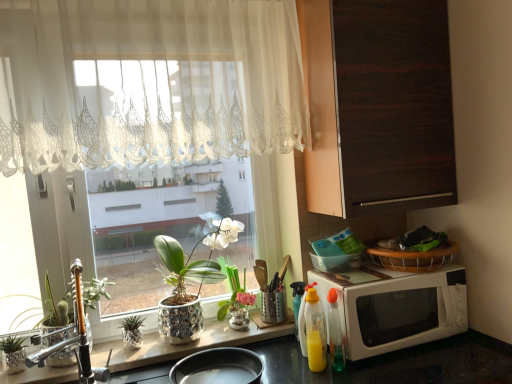
Question: Is green metallic plant at left, placed as the second houseplant when sorted from left to right, bigger or smaller than dark wood cabinet at upper right?

Choices:
 (A) big
 (B) small

Answer: (B)

Question: Looking at their shapes, would you say green metallic plant at left, placed as the second houseplant when sorted from left to right, is wider or thinner than dark wood cabinet at upper right?

Choices:
 (A) thin
 (B) wide

Answer: (A)

Question: Which object is the closest to the matte silver pot at center, the 1th houseplant when ordered from right to left?

Choices:
 (A) translucent glass pineapple at lower center, the 3th houseplant from the left
 (B) translucent plastic bottle at lower right, which is counted as the third bottle, starting from the back
 (C) silver metallic pot at left, which is the first houseplant in left-to-right order
 (D) yellow plastic bottle at lower center, which is counted as the third bottle, starting from the front
 (E) dark wood cabinet at upper right

Answer: (D)

Question: Estimate the real-world distances between objects in this image. Which object is closer to the matte silver pot at center, the fifth houseplant from the left?

Choices:
 (A) dark wood cabinet at upper right
 (B) translucent glass pineapple at lower center, the 3th houseplant from the left
 (C) yellow translucent bottle at lower right, which appears as the 4th bottle when viewed from the back
 (D) yellow plastic bottle at lower center, which is counted as the third bottle, starting from the front
 (E) silver metallic pot at left, the fifth houseplant from the right

Answer: (D)